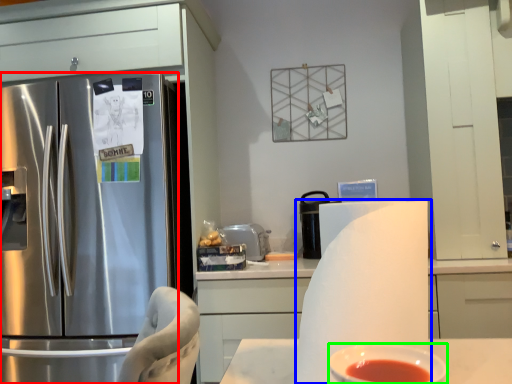
Question: Which object is the farthest from refrigerator (highlighted by a red box)? Choose among these: paper towel (highlighted by a blue box) or bowl (highlighted by a green box).

Choices:
 (A) paper towel
 (B) bowl

Answer: (B)